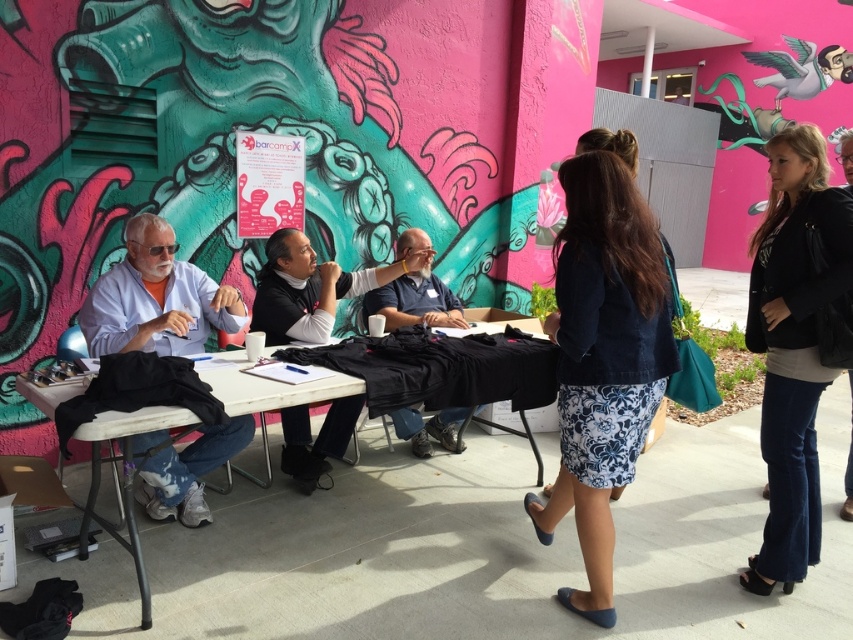
You are attending an outdoor event and notice two people wearing black clothing. One is wearing a black leather jacket at lower right and the other has a black matte shirt at center. Which person is sitting closer to the front of the table?

The black leather jacket at lower right is positioned under the black matte shirt at center, meaning the person in the black leather jacket at lower right is sitting closer to the front of the table.

You are standing at the point labeled point [149,241] and want to walk to the point labeled point [780,372]. Which direction should you move to reach your destination?

To reach point [780,372] from point [149,241], you should move forward since point [780,372] is in front of point [149,241].